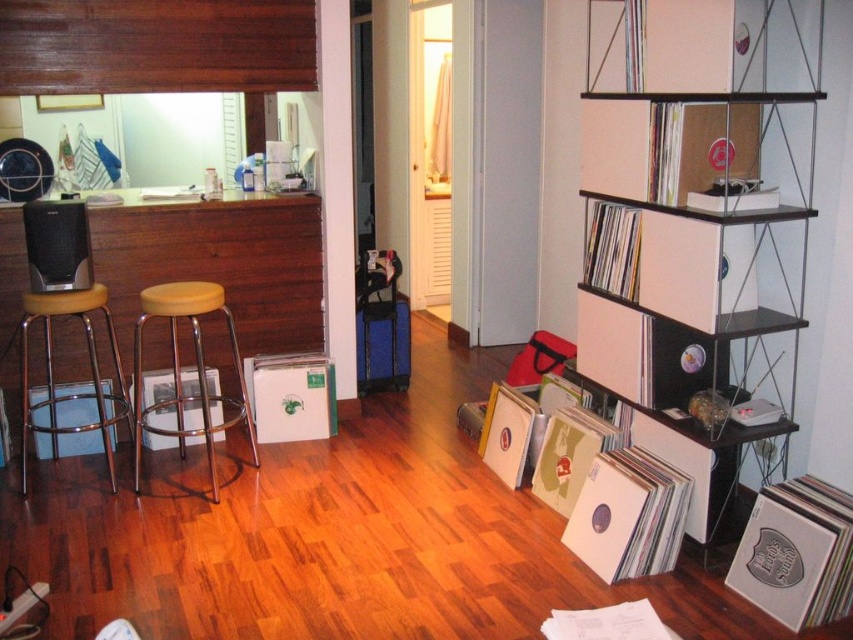
You are organizing a small party and need to place a decorative item on the white plastic shelf at upper right. Considering the size of the shelf compared to the yellow matte bar stool at left, can you fit a large vase that requires more space than the shelf?

The white plastic shelf at upper right is smaller than the yellow matte bar stool at left. Since the vase requires more space than the shelf, it won

You are rearranging furniture in the living room. You want to place a new plant on the white cardboard shelf at upper right. Is the shelf above or below the metallic yellow bar stool at left?

The white cardboard shelf at upper right is located above the metallic yellow bar stool at left, so it is positioned above the stool.

You are arranging a party and want to place a decorative item on the white cardboard shelf at upper right and the metallic yellow bar stool at left. Which object is located to the right side of the other?

The white cardboard shelf at upper right is positioned on the right side of metallic yellow bar stool at left.